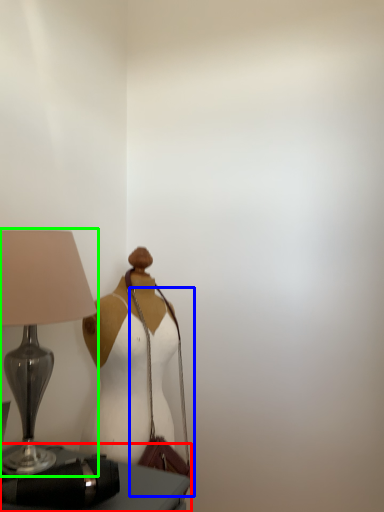
Question: Which object is positioned farthest from furniture (highlighted by a red box)? Select from shoulder bag (highlighted by a blue box) and lamp (highlighted by a green box).

Choices:
 (A) shoulder bag
 (B) lamp

Answer: (B)